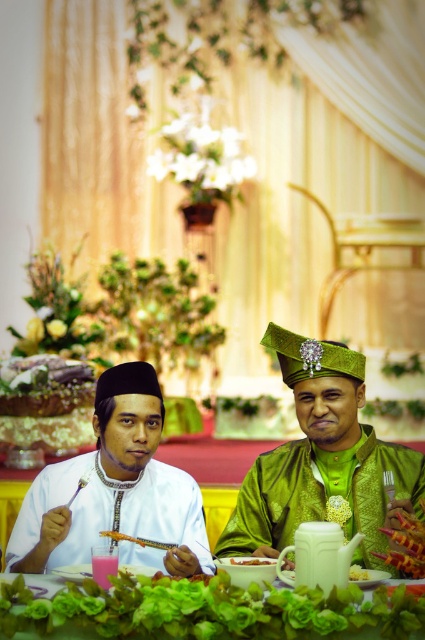
You are a photographer planning to take a closeup shot of the white glossy rice at center. You want to ensure the white matte shirt at center does not block the view. Based on the scene description, will the shirt block the rice in the photo?

The white matte shirt at center is wider than the white glossy rice at center. Since the shirt is wider, it might block the view of the rice depending on their exact positions. Adjust the camera angle or position to ensure the shirt doesn not obstruct the rice.

You are a photographer at the event and need to ensure both the white satin shirt at left and the orange textured food at center are visible in the photo. Considering their heights, which one might block the other from view if positioned improperly?

The white satin shirt at left is much taller than the orange textured food at center, so if positioned between the camera and the food, it could block the view of the orange textured food at center.